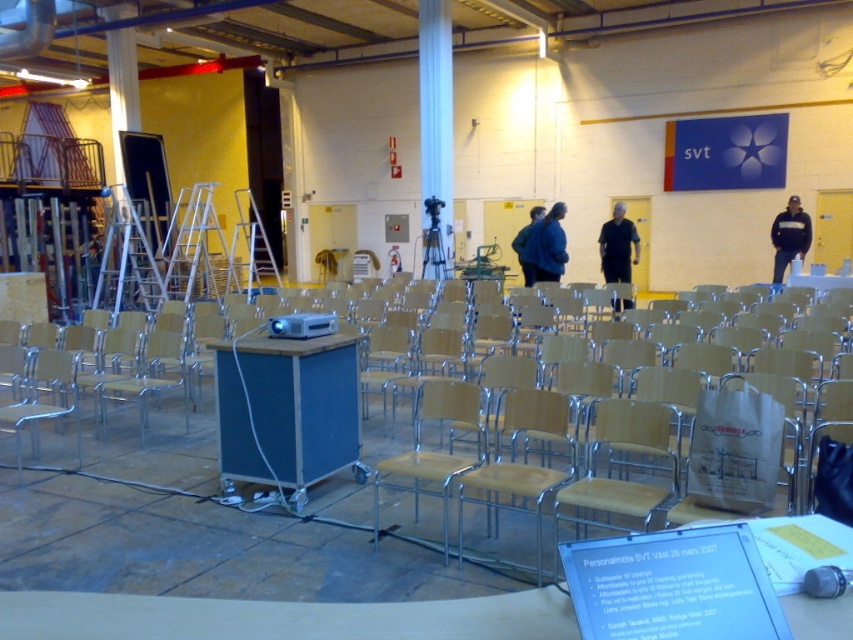
Based on the photo, which is above, black matte shirt at center or blue fabric jacket at center?

black matte shirt at center is higher up.

Which of these two, black matte shirt at center or blue fabric jacket at center, stands taller?

black matte shirt at center

Which is behind, point (637, 244) or point (550, 244)?

Positioned behind is point (637, 244).

At what (x,y) coordinates should I click in order to perform the action: click on black matte shirt at center. Please return your answer as a coordinate pair (x, y). Image resolution: width=853 pixels, height=640 pixels. Looking at the image, I should click on [618, 246].

Is wooden at center below wooden seat at center?

Yes, wooden at center is below wooden seat at center.

From the picture: Which is below, wooden at center or wooden seat at center?

wooden at center

Is point (619, 412) positioned in front of point (427, 454)?

Yes.

Locate an element on the screen. wooden at center is located at coordinates (622, 468).

Does wooden at center appear on the left side of wooden chair at lower left?

No, wooden at center is not to the left of wooden chair at lower left.

Between wooden at center and wooden chair at lower left, which one appears on the left side from the viewer's perspective?

Positioned to the left is wooden chair at lower left.

Who is more forward, (592,433) or (79,465)?

Point (592,433) is in front.

This screenshot has height=640, width=853. In order to click on wooden at center in this screenshot , I will do click(622, 468).